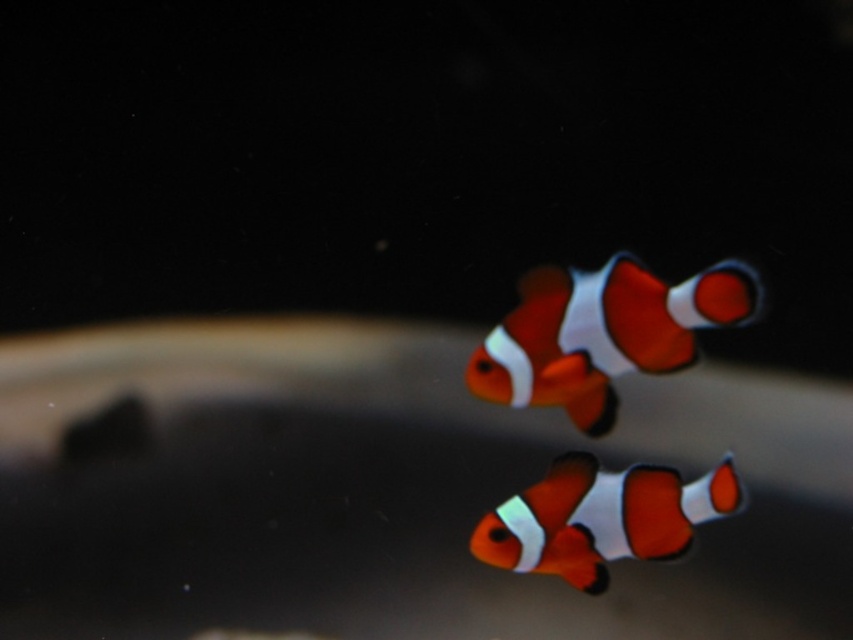
You are an aquarium caretaker observing two fish in the tank. You notice an orange and white clownfish at center and an orange matte clownfish at lower center. Which one is located to the right of the other?

The orange and white clownfish at center is positioned on the right side of orange matte clownfish at lower center.

You are an aquarium caretaker who needs to place both the orange and white clownfish at center and the orange matte clownfish at lower center into a small tank. Based on their sizes, will the tank be overcrowded?

The orange and white clownfish at center is larger than the orange matte clownfish at lower center. Since both fish need adequate space, the tank might become overcrowded if it is small and cannot accommodate their combined size requirements.